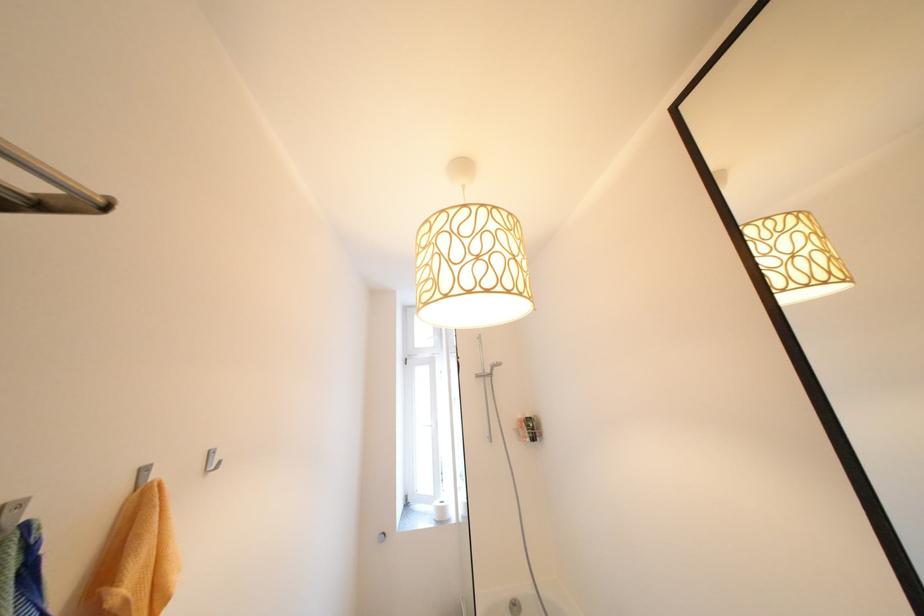
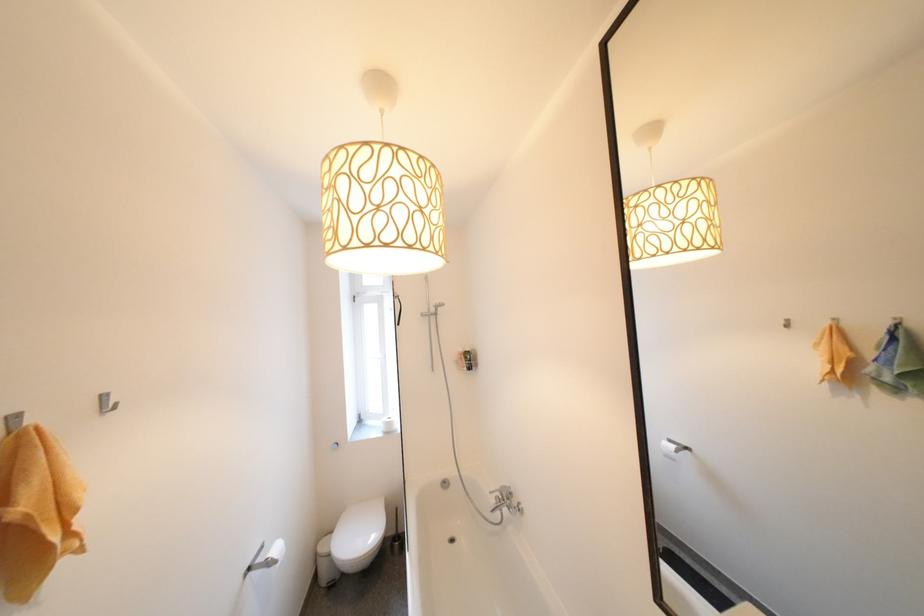
The point at (x=219, y=453) is marked in the first image. Where is the corresponding point in the second image?

(111, 397)